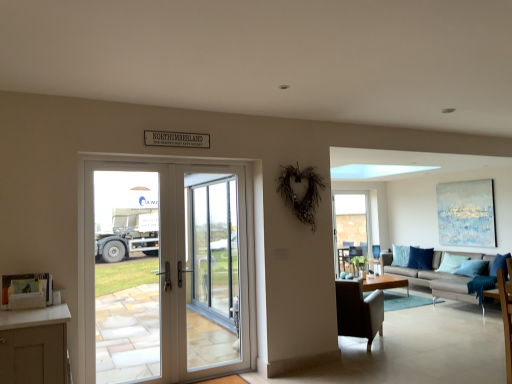
Question: Is light brown wooden coffee table at center completely or partially outside of white glass door at center?

Choices:
 (A) yes
 (B) no

Answer: (A)

Question: Is there a large distance between light brown wooden coffee table at center and white glass door at center?

Choices:
 (A) yes
 (B) no

Answer: (A)

Question: Does light brown wooden coffee table at center have a greater width compared to white glass door at center?

Choices:
 (A) yes
 (B) no

Answer: (A)

Question: From a real-world perspective, is light brown wooden coffee table at center below white glass door at center?

Choices:
 (A) yes
 (B) no

Answer: (A)

Question: Is light brown wooden coffee table at center shorter than white glass door at center?

Choices:
 (A) no
 (B) yes

Answer: (B)

Question: Relative to blue fabric pillow at right, is brown leather chair at center in front or behind?

Choices:
 (A) front
 (B) behind

Answer: (A)

Question: Is brown leather chair at center taller or shorter than blue fabric pillow at right?

Choices:
 (A) tall
 (B) short

Answer: (A)

Question: Is brown leather chair at center wider or thinner than blue fabric pillow at right?

Choices:
 (A) wide
 (B) thin

Answer: (A)

Question: From the image's perspective, relative to blue fabric pillow at right, is brown leather chair at center above or below?

Choices:
 (A) above
 (B) below

Answer: (B)

Question: From a real-world perspective, is brown leather chair at center physically located above or below white glossy screen door at center?

Choices:
 (A) below
 (B) above

Answer: (A)

Question: Based on their positions, is brown leather chair at center located to the left or right of white glossy screen door at center?

Choices:
 (A) right
 (B) left

Answer: (A)

Question: From their relative heights in the image, would you say brown leather chair at center is taller or shorter than white glossy screen door at center?

Choices:
 (A) short
 (B) tall

Answer: (A)

Question: Relative to white glossy screen door at center, is brown leather chair at center in front or behind?

Choices:
 (A) front
 (B) behind

Answer: (B)

Question: Considering their positions, is brown leather chair at center located in front of or behind light brown wooden coffee table at center?

Choices:
 (A) front
 (B) behind

Answer: (A)

Question: In terms of height, does brown leather chair at center look taller or shorter compared to light brown wooden coffee table at center?

Choices:
 (A) short
 (B) tall

Answer: (B)